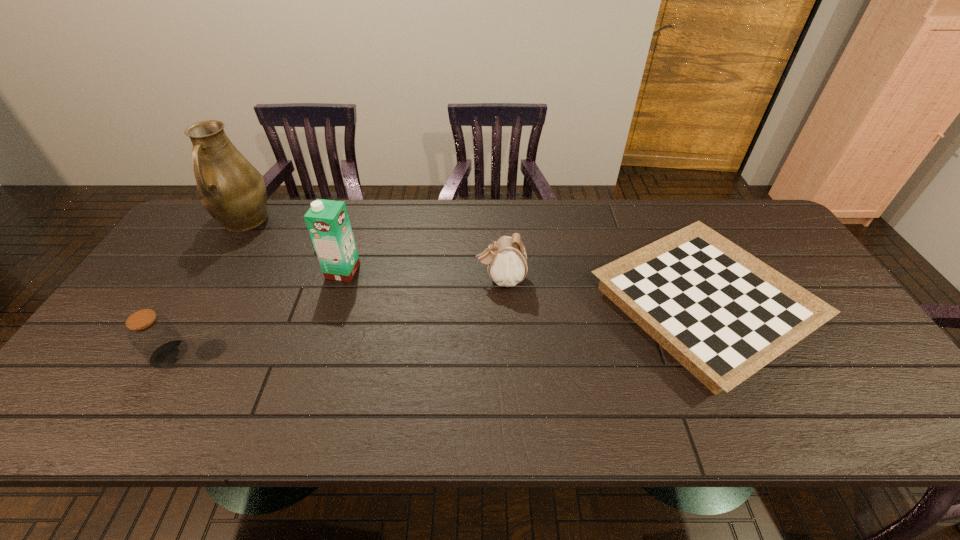
Image resolution: width=960 pixels, height=540 pixels. I want to click on vacant region located 0.080m on the front-facing side of the fourth object from left to right, so click(x=447, y=279).

Where is `vacant region located 0.050m on the front-facing side of the fourth object from left to right`? vacant region located 0.050m on the front-facing side of the fourth object from left to right is located at coordinates (458, 279).

Locate an element on the screen. Image resolution: width=960 pixels, height=540 pixels. vacant position located on the back of the second shortest object is located at coordinates (233, 247).

Locate an element on the screen. vacant space positioned 0.190m on the back of the shortest object is located at coordinates (653, 200).

This screenshot has height=540, width=960. I want to click on pitcher that is at the far edge, so click(229, 187).

Find the location of a particular element. checkerboard at the far edge is located at coordinates (722, 313).

Locate an element on the screen. This screenshot has height=540, width=960. object located in the near edge section of the desktop is located at coordinates (722, 313).

The height and width of the screenshot is (540, 960). In order to click on pitcher that is positioned at the left edge in this screenshot , I will do `click(229, 187)`.

Locate an element on the screen. Image resolution: width=960 pixels, height=540 pixels. jar that is at the left edge is located at coordinates (154, 336).

You are a GUI agent. You are given a task and a screenshot of the screen. Output one action in this format:
    pyautogui.click(x=<x>, y=<y>)
    Task: Click on the object present at the right edge
    This screenshot has height=540, width=960.
    Given the screenshot: What is the action you would take?
    pyautogui.click(x=722, y=313)